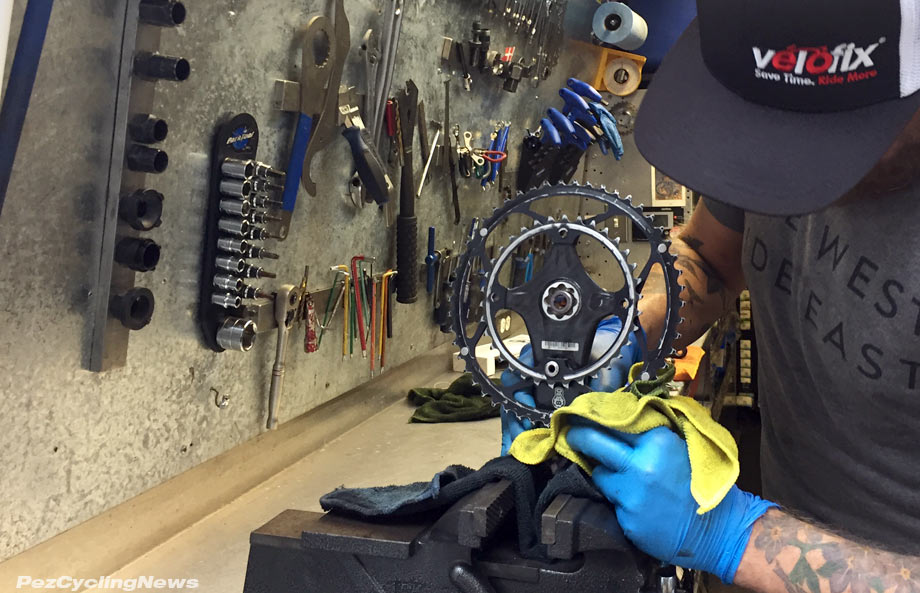
Identify the location of tools hanging on the wall. (130, 258), (231, 246), (315, 89), (357, 291), (399, 151), (474, 60), (480, 156), (431, 267), (20, 75), (531, 23).